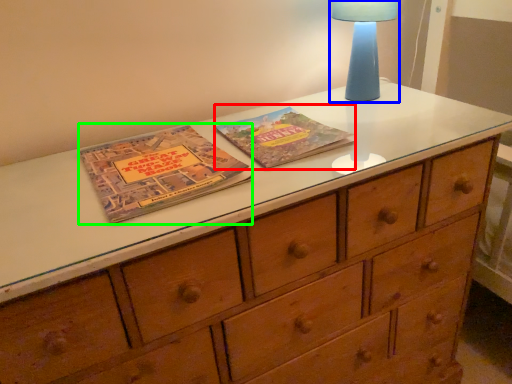
Question: Which is farther away from paperback book (highlighted by a red box)? bedside lamp (highlighted by a blue box) or paperback book (highlighted by a green box)?

Choices:
 (A) bedside lamp
 (B) paperback book

Answer: (A)